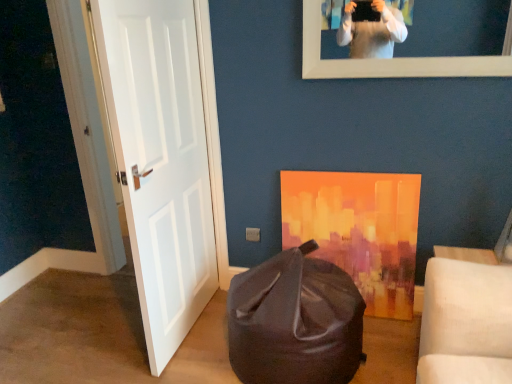
Identify the location of matte black bean bag at lower center. (295, 321).

Describe the element at coordinates (388, 59) in the screenshot. The image size is (512, 384). I see `white matte picture frame at upper center` at that location.

Identify the location of white matte door at left. (160, 160).

What do you see at coordinates (160, 160) in the screenshot? This screenshot has height=384, width=512. I see `white matte door at left` at bounding box center [160, 160].

Locate an element on the screen. The width and height of the screenshot is (512, 384). matte black bean bag at lower center is located at coordinates (295, 321).

From a real-world perspective, is white matte door at left physically below white matte picture frame at upper center?

Yes, from a real-world perspective, white matte door at left is below white matte picture frame at upper center.

Is white matte door at left aimed at white matte picture frame at upper center?

No, white matte door at left is not aimed at white matte picture frame at upper center.

Does point (134, 158) come behind point (443, 58)?

That is False.

Consider the image. Is white matte door at left wider or thinner than white matte picture frame at upper center?

Clearly, white matte door at left has more width compared to white matte picture frame at upper center.

Would you say matte black bean bag at lower center is a long distance from white matte picture frame at upper center?

matte black bean bag at lower center is positioned a significant distance from white matte picture frame at upper center.

Is matte black bean bag at lower center facing towards white matte picture frame at upper center?

No, matte black bean bag at lower center is not turned towards white matte picture frame at upper center.

Is the position of matte black bean bag at lower center less distant than that of white matte picture frame at upper center?

That is True.

Between matte black bean bag at lower center and white matte door at left, which one has smaller size?

Smaller between the two is white matte door at left.

Does matte black bean bag at lower center contain white matte door at left?

No, matte black bean bag at lower center does not contain white matte door at left.

Is matte black bean bag at lower center not near white matte door at left?

No, matte black bean bag at lower center is not far from white matte door at left.

Does matte black bean bag at lower center appear on the left side of white matte door at left?

Incorrect, matte black bean bag at lower center is not on the left side of white matte door at left.

Is white matte picture frame at upper center closer to the viewer compared to matte black bean bag at lower center?

No, it is not.

Is white matte picture frame at upper center oriented away from matte black bean bag at lower center?

That's not correct — white matte picture frame at upper center is not looking away from matte black bean bag at lower center.

From the picture: Can you confirm if white matte picture frame at upper center is smaller than matte black bean bag at lower center?

Correct, white matte picture frame at upper center occupies less space than matte black bean bag at lower center.

Considering the points (439, 66) and (250, 375), which point is in front, point (439, 66) or point (250, 375)?

The point (250, 375) is closer.

Can you confirm if white matte door at left is taller than matte black bean bag at lower center?

Yes.

At what (x,y) coordinates should I click in order to perform the action: click on door located on the left of matte black bean bag at lower center. Please return your answer as a coordinate pair (x, y). Looking at the image, I should click on (160, 160).

Can you confirm if white matte door at left is positioned to the right of matte black bean bag at lower center?

No.

Measure the distance between white matte picture frame at upper center and white matte door at left.

white matte picture frame at upper center is 34.77 inches away from white matte door at left.

Can you confirm if white matte picture frame at upper center is thinner than white matte door at left?

Yes, white matte picture frame at upper center is thinner than white matte door at left.

Could you tell me if white matte picture frame at upper center is turned towards white matte door at left?

No, white matte picture frame at upper center is not oriented towards white matte door at left.

From a real-world perspective, who is located lower, white matte picture frame at upper center or white matte door at left?

white matte door at left is physically lower.

The image size is (512, 384). What are the coordinates of `door in front of the white matte picture frame at upper center` in the screenshot? It's located at (160, 160).

Identify the location of picture frame lying above the matte black bean bag at lower center (from the image's perspective). The image size is (512, 384). (x=388, y=59).

When comparing their distances from matte black bean bag at lower center, does white matte picture frame at upper center or white matte door at left seem closer?

white matte door at left is positioned closer to the anchor matte black bean bag at lower center.

Considering their positions, is matte black bean bag at lower center positioned further to white matte picture frame at upper center than white matte door at left?

matte black bean bag at lower center lies further to white matte picture frame at upper center than the other object.

From the picture: From the image, which object appears to be farther from white matte door at left, matte black bean bag at lower center or white matte picture frame at upper center?

white matte picture frame at upper center is positioned further to the anchor white matte door at left.

Considering their positions, is white matte picture frame at upper center positioned further to white matte door at left than matte black bean bag at lower center?

white matte picture frame at upper center is positioned further to the anchor white matte door at left.

When comparing their distances from white matte picture frame at upper center, does white matte door at left or matte black bean bag at lower center seem closer?

white matte door at left lies closer to white matte picture frame at upper center than the other object.

Considering their positions, is white matte door at left positioned closer to matte black bean bag at lower center than white matte picture frame at upper center?

The object closer to matte black bean bag at lower center is white matte door at left.

Locate an element on the screen. Image resolution: width=512 pixels, height=384 pixels. door between white matte picture frame at upper center and matte black bean bag at lower center vertically is located at coordinates (160, 160).